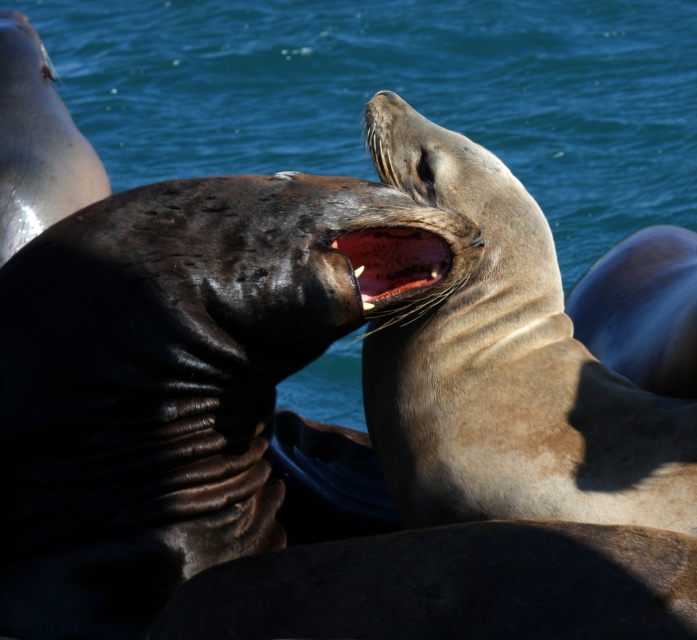
You are observing two points in a sea lions area. The first point is at point (x=516, y=360) and the second is at point (x=376, y=305). From your viewpoint, which point is closer to you?

Point (x=376, y=305) is closer to you because point (x=516, y=360) is behind it.